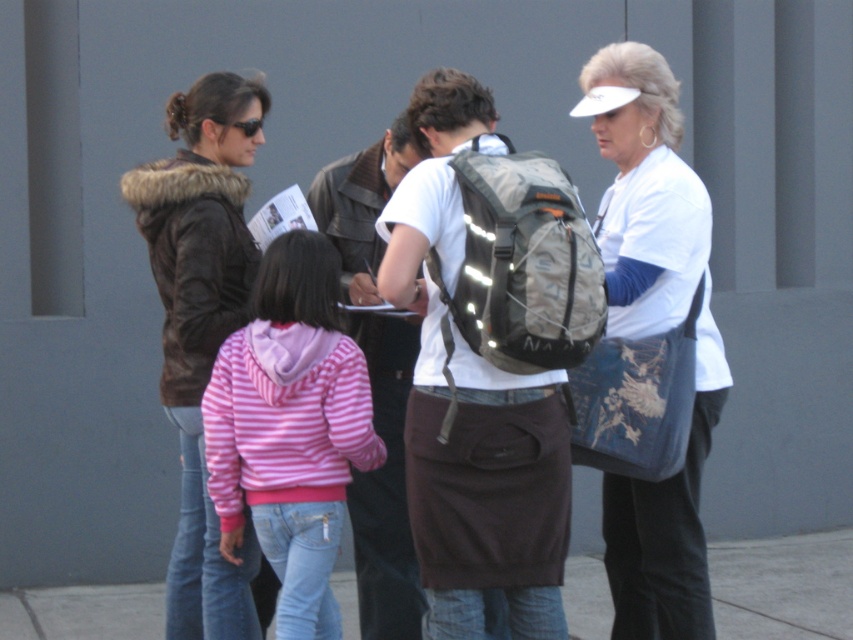
You are organizing a hiking trip and need to decide which bag to use. The matte black backpack at center and the white fabric bag at right are available. Based on their sizes, which one can carry more gear?

The matte black backpack at center has a larger size compared to the white fabric bag at right, so it can carry more gear.